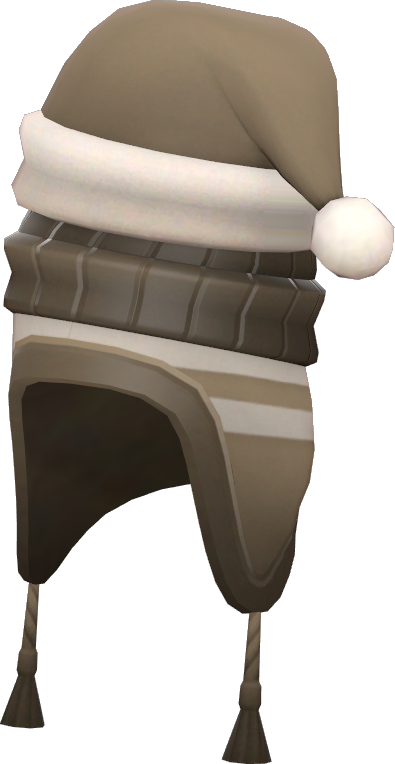
I want to click on tassles, so click(254, 694), click(30, 656).